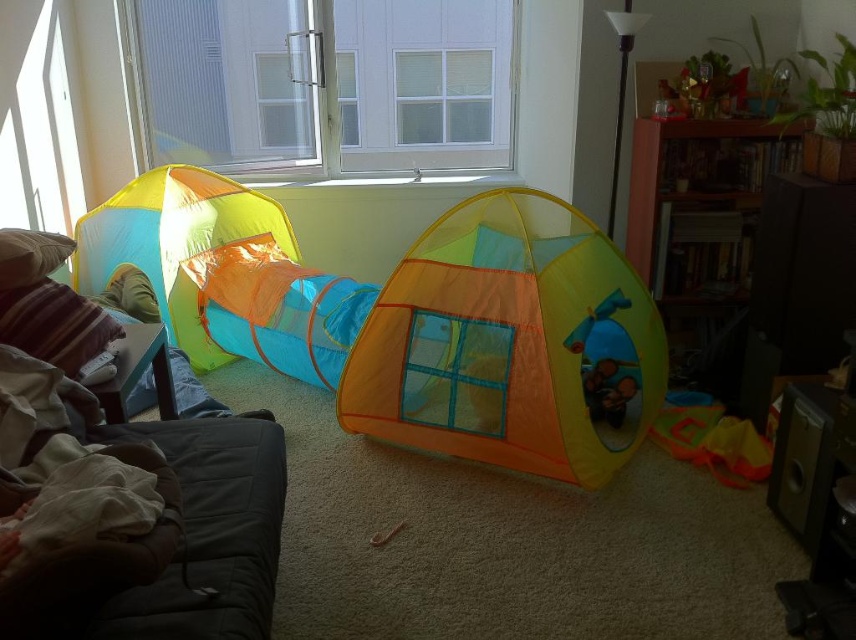
Is translucent nylon tent at center shorter than velvet brown couch at left?

No.

Can you confirm if translucent nylon tent at center is bigger than velvet brown couch at left?

Indeed, translucent nylon tent at center has a larger size compared to velvet brown couch at left.

Who is more forward, (515, 193) or (206, 588)?

Point (206, 588)

This screenshot has height=640, width=856. What are the coordinates of `translucent nylon tent at center` in the screenshot? It's located at (510, 342).

Does translucent nylon tent at center appear under translucent nylon tent at left?

Indeed, translucent nylon tent at center is positioned under translucent nylon tent at left.

Does translucent nylon tent at center have a lesser height compared to translucent nylon tent at left?

In fact, translucent nylon tent at center may be taller than translucent nylon tent at left.

Between point (581, 372) and point (107, 276), which one is positioned in front?

Point (581, 372)

The height and width of the screenshot is (640, 856). Find the location of `translucent nylon tent at center`. translucent nylon tent at center is located at coordinates (510, 342).

Is translucent nylon tent at left bigger than translucent orange fabric play tent at center?

Correct, translucent nylon tent at left is larger in size than translucent orange fabric play tent at center.

Is point (88, 246) less distant than point (192, 301)?

No, (88, 246) is behind (192, 301).

This screenshot has width=856, height=640. What are the coordinates of `translucent nylon tent at left` in the screenshot? It's located at (175, 243).